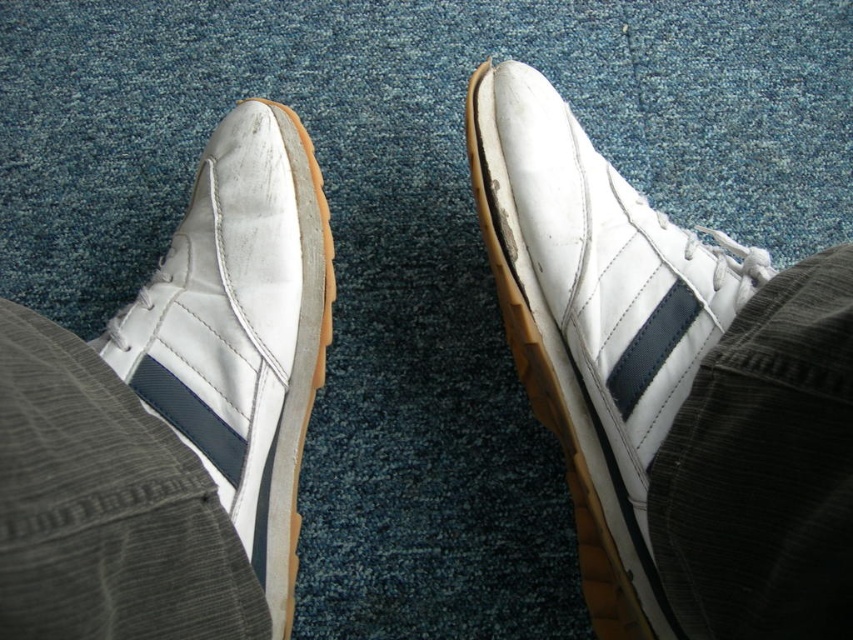
Does point (662, 282) come closer to viewer compared to point (236, 369)?

No, (662, 282) is behind (236, 369).

Where is `white leather shoe at upper center`? white leather shoe at upper center is located at coordinates (596, 321).

This screenshot has height=640, width=853. What are the coordinates of `white leather shoe at upper center` in the screenshot? It's located at (596, 321).